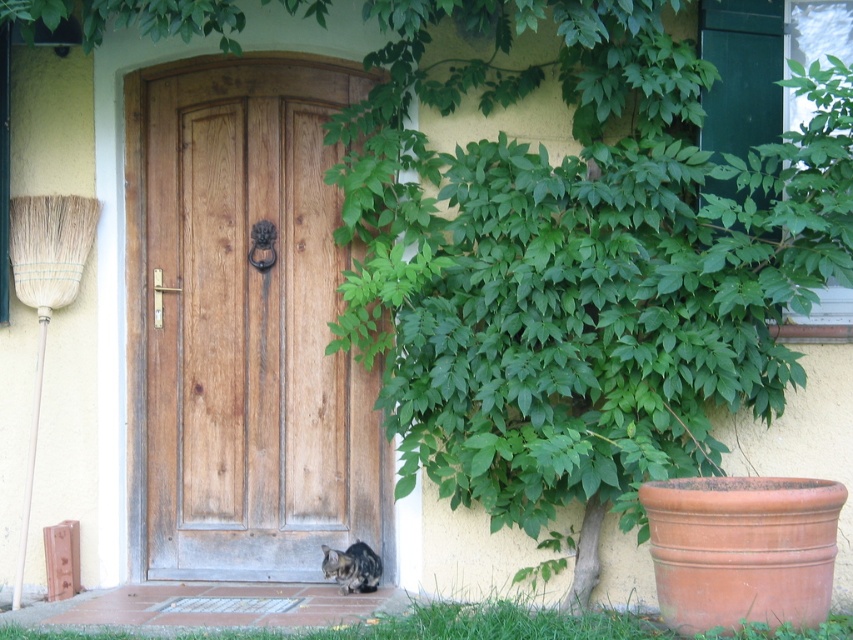
Who is lower down, green leafy plant at lower right or tabby fur cat at lower center?

Positioned lower is green leafy plant at lower right.

Can you confirm if green leafy plant at lower right is taller than tabby fur cat at lower center?

In fact, green leafy plant at lower right may be shorter than tabby fur cat at lower center.

This screenshot has height=640, width=853. What are the coordinates of `green leafy plant at lower right` in the screenshot? It's located at (334, 618).

Image resolution: width=853 pixels, height=640 pixels. What are the coordinates of `green leafy plant at lower right` in the screenshot? It's located at (334, 618).

Can you confirm if natural wood door at center is bigger than tabby fur cat at lower center?

Correct, natural wood door at center is larger in size than tabby fur cat at lower center.

Is natural wood door at center closer to camera compared to tabby fur cat at lower center?

That is False.

Which is behind, point (225, 477) or point (370, 584)?

The point (225, 477) is more distant.

Where is `natural wood door at center`? The height and width of the screenshot is (640, 853). natural wood door at center is located at coordinates (245, 326).

Between natural wood door at center and green leafy plant at lower right, which one is positioned higher?

natural wood door at center is higher up.

Which of these two, natural wood door at center or green leafy plant at lower right, stands taller?

With more height is natural wood door at center.

Looking at this image, measure the distance between point (364, 476) and camera.

The distance of point (364, 476) from camera is 17.12 feet.

You are a GUI agent. You are given a task and a screenshot of the screen. Output one action in this format:
    pyautogui.click(x=<x>, y=<y>)
    Task: Click on the natural wood door at center
    The width and height of the screenshot is (853, 640).
    Given the screenshot: What is the action you would take?
    pyautogui.click(x=245, y=326)